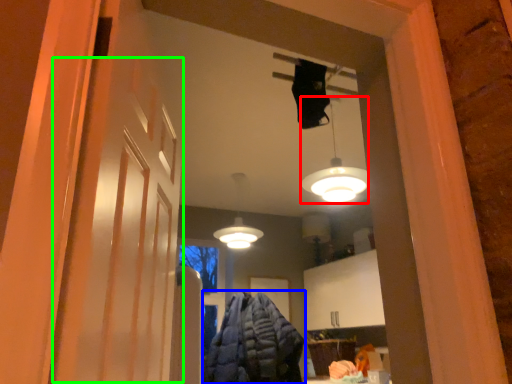
Question: Estimate the real-world distances between objects in this image. Which object is closer to lamp (highlighted by a red box), clothing (highlighted by a blue box) or barn door (highlighted by a green box)?

Choices:
 (A) clothing
 (B) barn door

Answer: (A)